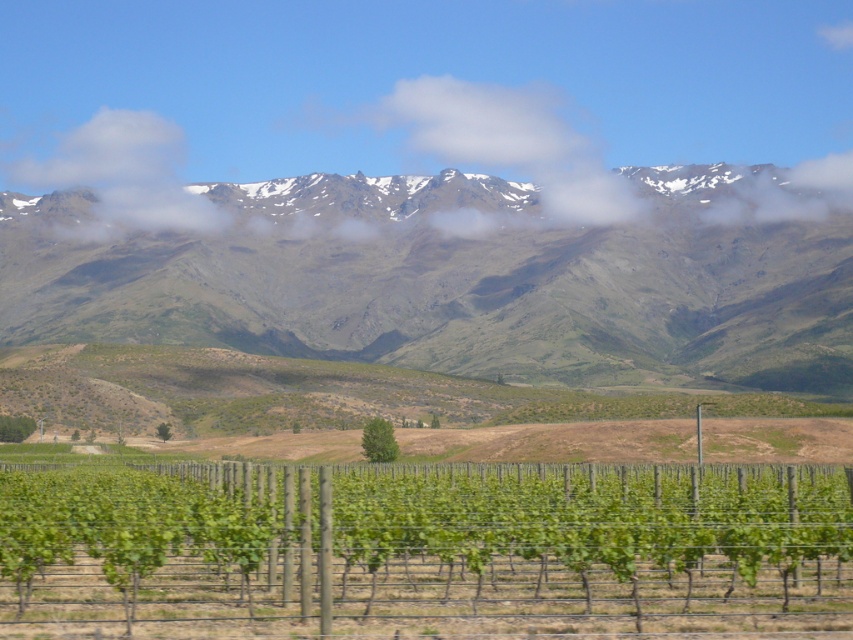
You are an artist planning to paint this landscape. You want to emphasize the contrast between the green leafy vine at center and the snowy mountain range at upper center. Which object should you make wider in your painting to highlight this contrast?

To emphasize the contrast, you should make the green leafy vine at center wider since its actual width is less than the snowy mountain range at upper center, allowing you to exaggerate the size difference for dramatic effect.

You are standing in the vineyard and looking at the green leafy vine at center and the snowy mountain range at upper center. Which one appears nearer to you?

The green leafy vine at center appears nearer to you because it is closer to the viewer than the snowy mountain range at upper center.

You are an airplane passenger looking out the window and see the green grassy mountain range at upper center and the snowy mountain range at upper center. Which mountain range is closer to the airplane?

The green grassy mountain range at upper center is closer to the airplane because it is in front of the snowy mountain range at upper center.